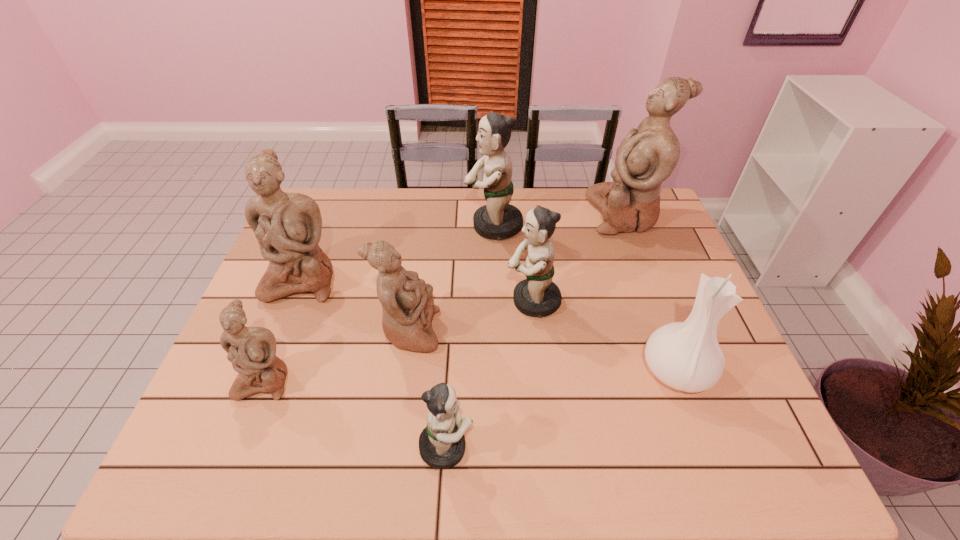
The width and height of the screenshot is (960, 540). What are the coordinates of `object that is the fifth nearest to the nearest figurine` in the screenshot? It's located at (288, 226).

Locate an element on the screen. This screenshot has height=540, width=960. the closest object to the rightmost white figurine is located at coordinates (497, 219).

Find the location of a particular element. The image size is (960, 540). figurine that is the nearest to the farthest white figurine is located at coordinates (497, 219).

Select which figurine is the second closest to the second biggest white figurine. Please provide its 2D coordinates. Your answer should be formatted as a tuple, i.e. [(x, y)], where the tuple contains the x and y coordinates of a point satisfying the conditions above.

[(252, 350)]

Locate an element on the screen. The width and height of the screenshot is (960, 540). white figurine that stands as the fourth closest to the second smallest green figurine is located at coordinates (252, 350).

This screenshot has width=960, height=540. I want to click on white figurine that stands as the third closest to the second nearest white figurine, so click(x=646, y=157).

Select which green figurine is the third closest to the nearest white figurine. Please provide its 2D coordinates. Your answer should be formatted as a tuple, i.e. [(x, y)], where the tuple contains the x and y coordinates of a point satisfying the conditions above.

[(497, 219)]

Locate which green figurine is the second closest to the third biggest white figurine. Please provide its 2D coordinates. Your answer should be formatted as a tuple, i.e. [(x, y)], where the tuple contains the x and y coordinates of a point satisfying the conditions above.

[(442, 443)]

Locate an element on the screen. This screenshot has width=960, height=540. free space that satisfies the following two spatial constraints: 1. on the front side of the vase; 2. on the front-facing side of the smallest green figurine is located at coordinates [x=705, y=447].

Locate an element on the screen. Image resolution: width=960 pixels, height=540 pixels. vacant space that satisfies the following two spatial constraints: 1. on the back side of the white vase; 2. on the front-facing side of the third biggest white figurine is located at coordinates (661, 331).